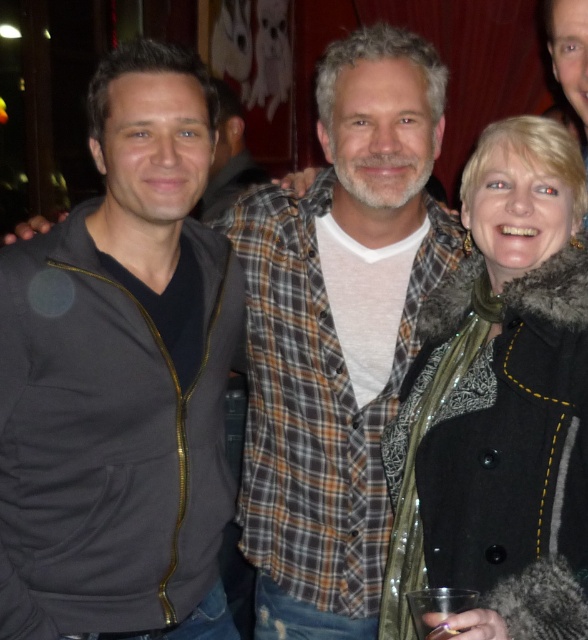
Does matte black jacket at left appear under fur-lined coat at center?

Actually, matte black jacket at left is above fur-lined coat at center.

Who is positioned more to the right, matte black jacket at left or fur-lined coat at center?

From the viewer's perspective, fur-lined coat at center appears more on the right side.

Is point (132, 476) positioned in front of point (579, 186)?

No, it is not.

Locate an element on the screen. matte black jacket at left is located at coordinates (121, 378).